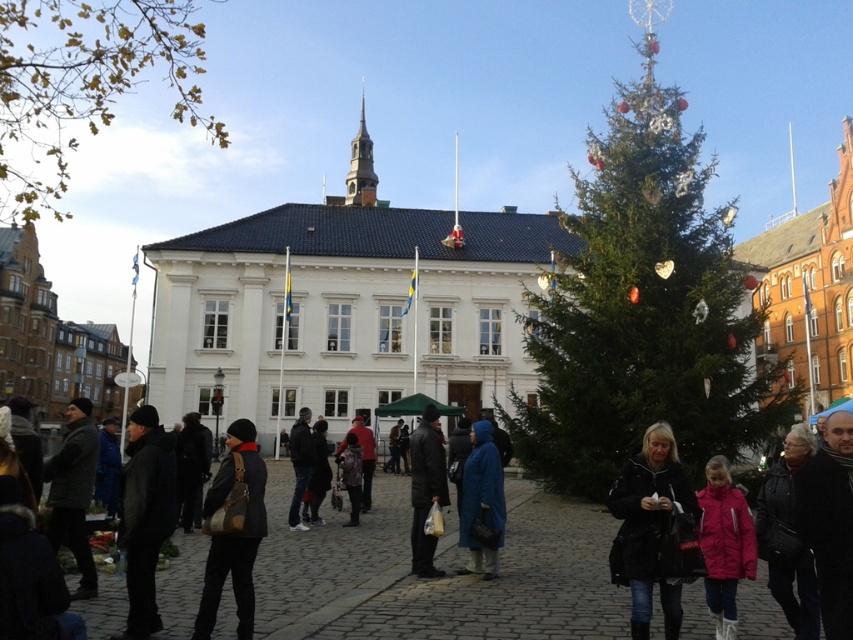
Question: Can you confirm if black leather jacket at center is positioned to the left of blue matte coat at center?

Choices:
 (A) yes
 (B) no

Answer: (B)

Question: Which object is closer to the camera taking this photo?

Choices:
 (A) black leather jacket at center
 (B) pink matte jacket at lower right

Answer: (A)

Question: Does pink matte jacket at lower right appear on the left side of blue matte coat at center?

Choices:
 (A) yes
 (B) no

Answer: (B)

Question: Is matte black jacket at center in front of pink matte jacket at lower right?

Choices:
 (A) yes
 (B) no

Answer: (A)

Question: Which point is farther from the camera taking this photo?

Choices:
 (A) (718, 636)
 (B) (643, 632)
 (C) (469, 518)
 (D) (409, 436)

Answer: (D)

Question: Which of the following is the farthest from the observer?

Choices:
 (A) matte black jacket at center
 (B) blue matte coat at center
 (C) black leather jacket at center

Answer: (B)